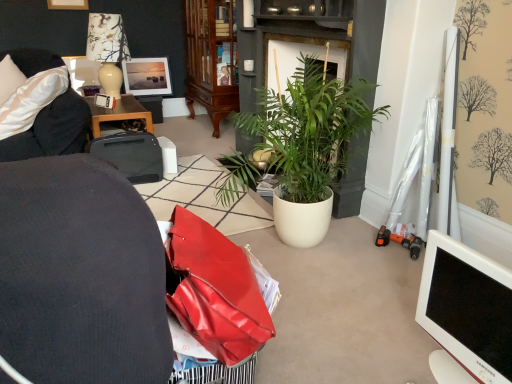
Measure the distance between black plastic printer at upper left and camera.

black plastic printer at upper left is 2.83 meters from camera.

The height and width of the screenshot is (384, 512). Describe the element at coordinates (106, 50) in the screenshot. I see `white glossy lamp at upper left` at that location.

Looking at this image, what is the approximate height of white glossy lamp at upper left?

white glossy lamp at upper left is 25.47 inches in height.

The width and height of the screenshot is (512, 384). What do you see at coordinates (131, 155) in the screenshot? I see `black plastic printer at center` at bounding box center [131, 155].

Where is `wooden picture frame at upper left, positioned as the 1th picture frame in top-to-bottom order`? The width and height of the screenshot is (512, 384). wooden picture frame at upper left, positioned as the 1th picture frame in top-to-bottom order is located at coordinates (68, 4).

Identify the location of white fabric at center. (202, 198).

Is white fabric at center not near black plastic printer at upper left?

white fabric at center is near black plastic printer at upper left, not far away.

Does point (252, 197) come in front of point (118, 113)?

Yes, it is.

In terms of height, does white fabric at center look taller or shorter compared to black plastic printer at upper left?

white fabric at center is shorter than black plastic printer at upper left.

From the image's perspective, between white fabric at center and black plastic printer at upper left, who is located below?

white fabric at center, from the image's perspective.

Could you tell me if green leafy plant at center is turned towards wooden picture frame at upper left, the 2th picture frame positioned from the right?

No, green leafy plant at center is not aimed at wooden picture frame at upper left, the 2th picture frame positioned from the right.

Is wooden picture frame at upper left, which is the 2th picture frame from back to front, completely or partially inside green leafy plant at center?

Definitely not — wooden picture frame at upper left, which is the 2th picture frame from back to front, is not inside green leafy plant at center.

Considering the relative sizes of green leafy plant at center and wooden picture frame at upper left, which ranks as the second picture frame in bottom-to-top order, in the image provided, is green leafy plant at center wider than wooden picture frame at upper left, which ranks as the second picture frame in bottom-to-top order,?

Indeed, green leafy plant at center has a greater width compared to wooden picture frame at upper left, which ranks as the second picture frame in bottom-to-top order.

From the image's perspective, which object appears higher, satin cushioned sofa at left or white fabric at center?

From the image's view, satin cushioned sofa at left is above.

Looking at the image, does satin cushioned sofa at left seem bigger or smaller compared to white fabric at center?

Considering their sizes, satin cushioned sofa at left takes up more space than white fabric at center.

Which is behind, point (74, 97) or point (165, 190)?

The point (165, 190) is behind.

Is satin cushioned sofa at left turned away from white fabric at center?

Absolutely, satin cushioned sofa at left is directed away from white fabric at center.

Between white glossy lamp at upper left and satin cushioned sofa at left, which one has smaller width?

white glossy lamp at upper left is thinner.

From the image's perspective, is white glossy lamp at upper left under satin cushioned sofa at left?

Actually, white glossy lamp at upper left appears above satin cushioned sofa at left in the image.

Which is more to the left, white glossy lamp at upper left or satin cushioned sofa at left?

From the viewer's perspective, satin cushioned sofa at left appears more on the left side.

From a real-world perspective, is matte wooden picture frame at upper left, which is counted as the first picture frame, starting from the bottom, above or below wooden picture frame at upper left, which is the 2th picture frame from back to front?

From a real-world perspective, matte wooden picture frame at upper left, which is counted as the first picture frame, starting from the bottom, is physically below wooden picture frame at upper left, which is the 2th picture frame from back to front.

Is wooden picture frame at upper left, the 2th picture frame positioned from the right, located within matte wooden picture frame at upper left, the second picture frame positioned from the top?

No, matte wooden picture frame at upper left, the second picture frame positioned from the top, does not contain wooden picture frame at upper left, the 2th picture frame positioned from the right.

Is matte wooden picture frame at upper left, the 2th picture frame from the left, in contact with wooden picture frame at upper left, positioned as the 1th picture frame in top-to-bottom order?

No, matte wooden picture frame at upper left, the 2th picture frame from the left, is not touching wooden picture frame at upper left, positioned as the 1th picture frame in top-to-bottom order.

Is point (162, 64) positioned behind point (66, 1)?

Yes, it is behind point (66, 1).

Find the location of a particular element. chair on the left of black plastic printer at center is located at coordinates (52, 130).

Are satin cushioned sofa at left and black plastic printer at center located far from each other?

satin cushioned sofa at left is near black plastic printer at center, not far away.

How different are the orientations of satin cushioned sofa at left and black plastic printer at center in degrees?

The facing directions of satin cushioned sofa at left and black plastic printer at center are 104 degrees apart.

From the image's perspective, between satin cushioned sofa at left and black plastic printer at center, which one is located above?

satin cushioned sofa at left is shown above in the image.

From the image's perspective, is white glossy lamp at upper left above green leafy plant at center?

Yes, from the image's perspective, white glossy lamp at upper left is on top of green leafy plant at center.

Consider the image. Does white glossy lamp at upper left turn towards green leafy plant at center?

No, white glossy lamp at upper left is not oriented towards green leafy plant at center.

Is white glossy lamp at upper left thinner than green leafy plant at center?

Incorrect, the width of white glossy lamp at upper left is not less than that of green leafy plant at center.

Can you see white glossy lamp at upper left touching green leafy plant at center?

white glossy lamp at upper left and green leafy plant at center are clearly separated.

This screenshot has width=512, height=384. What are the coordinates of `desk located above the white fabric at center (from a real-world perspective)` in the screenshot? It's located at (119, 113).

Where is `houseplant that is in front of the wooden picture frame at upper left, the 1th picture frame in the front-to-back sequence`? The height and width of the screenshot is (384, 512). houseplant that is in front of the wooden picture frame at upper left, the 1th picture frame in the front-to-back sequence is located at coordinates coord(309,144).

Based on their spatial positions, is matte wooden picture frame at upper left, positioned as the 1th picture frame in right-to-left order, or white glossy lamp at upper left closer to mahogany glass-front cabinet at center?

The object closer to mahogany glass-front cabinet at center is matte wooden picture frame at upper left, positioned as the 1th picture frame in right-to-left order.

Considering their positions, is wooden picture frame at upper left, which is the 2th picture frame from back to front, positioned further to white fabric at center than satin cushioned sofa at left?

wooden picture frame at upper left, which is the 2th picture frame from back to front.

Which object lies nearer to the anchor point satin cushioned sofa at left, black plastic printer at center or wooden picture frame at upper left, the 1th picture frame in the front-to-back sequence?

black plastic printer at center is positioned closer to the anchor satin cushioned sofa at left.

Which object lies nearer to the anchor point green leafy plant at center, black plastic printer at upper left or satin cushioned sofa at left?

satin cushioned sofa at left is closer to green leafy plant at center.

From the image, which object appears to be farther from black plastic printer at center, satin cushioned sofa at left or mahogany glass-front cabinet at center?

The object further to black plastic printer at center is mahogany glass-front cabinet at center.

From the image, which object appears to be nearer to mahogany glass-front cabinet at center, satin cushioned sofa at left or white fabric at center?

white fabric at center.

Looking at the image, which one is located further to white plastic monitor at lower right, wooden picture frame at upper left, the first picture frame from the left, or white fabric at center?

wooden picture frame at upper left, the first picture frame from the left, lies further to white plastic monitor at lower right than the other object.

From the picture: When comparing their distances from white fabric at center, does satin cushioned sofa at left or white plastic monitor at lower right seem further?

white plastic monitor at lower right is further to white fabric at center.

Image resolution: width=512 pixels, height=384 pixels. I want to click on desk between mahogany glass-front cabinet at center and black plastic printer at center vertically, so click(119, 113).

This screenshot has height=384, width=512. Find the location of `picture frame located between wooden picture frame at upper left, the 1th picture frame in the front-to-back sequence, and mahogany glass-front cabinet at center in the left-right direction`. picture frame located between wooden picture frame at upper left, the 1th picture frame in the front-to-back sequence, and mahogany glass-front cabinet at center in the left-right direction is located at coordinates (147, 76).

The height and width of the screenshot is (384, 512). What are the coordinates of `lamp that lies between wooden picture frame at upper left, the first picture frame from the left, and black plastic printer at center from top to bottom` in the screenshot? It's located at (106, 50).

You are a GUI agent. You are given a task and a screenshot of the screen. Output one action in this format:
    pyautogui.click(x=<x>, y=<y>)
    Task: Click on the luggage and bags positioned between satin cushioned sofa at left and mahogany glass-front cabinet at center from near to far
    The height and width of the screenshot is (384, 512).
    Given the screenshot: What is the action you would take?
    pyautogui.click(x=131, y=155)